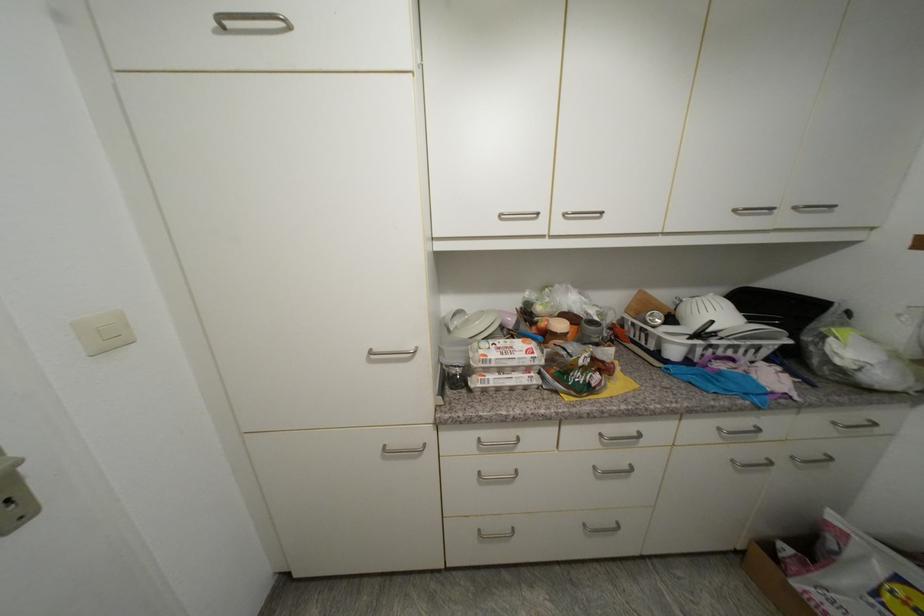
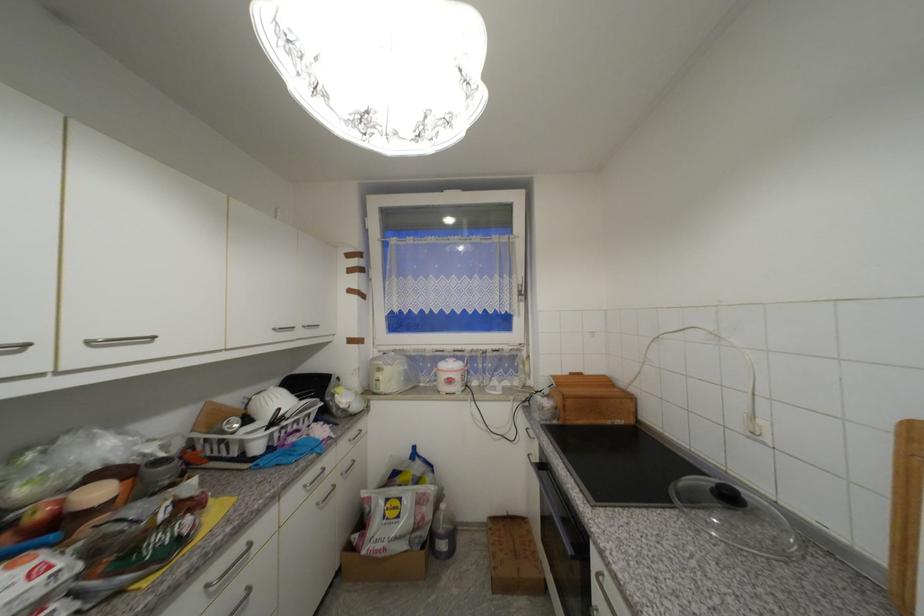
In the second image, find the point that corresponds to pixel 738 463 in the first image.

(322, 505)